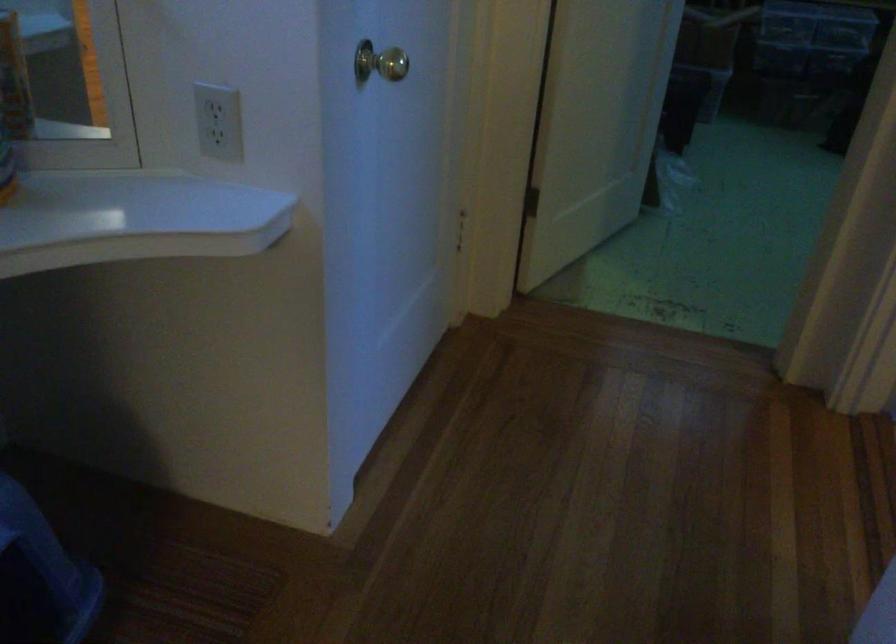
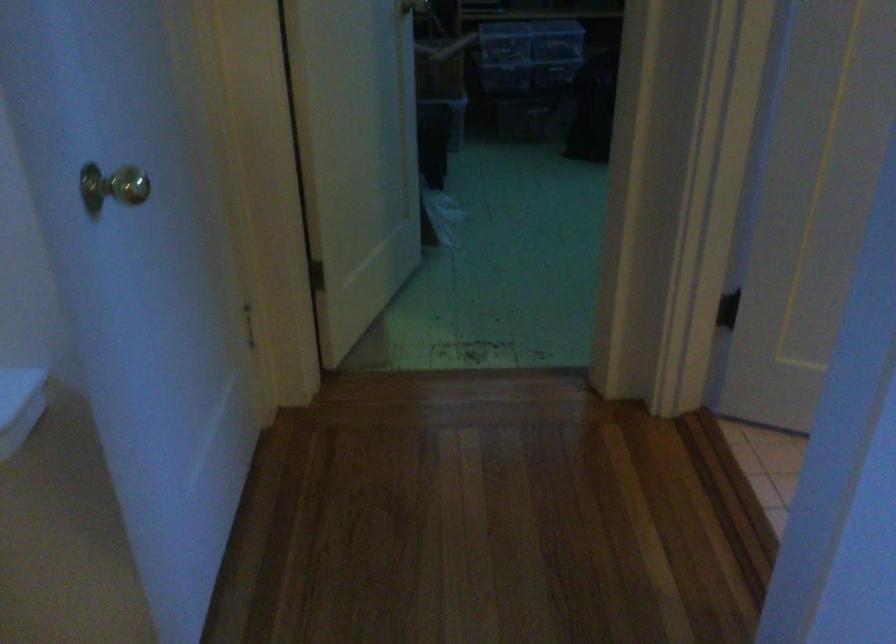
Question: What movement of the cameraman would produce the second image?

Choices:
 (A) Left
 (B) Right
 (C) Forward
 (D) Backward

Answer: (C)